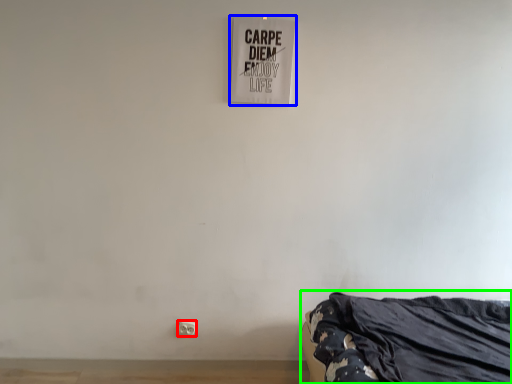
Question: Which object is the closest to the electric outlet (highlighted by a red box)? Choose among these: signage (highlighted by a blue box) or furniture (highlighted by a green box).

Choices:
 (A) signage
 (B) furniture

Answer: (B)